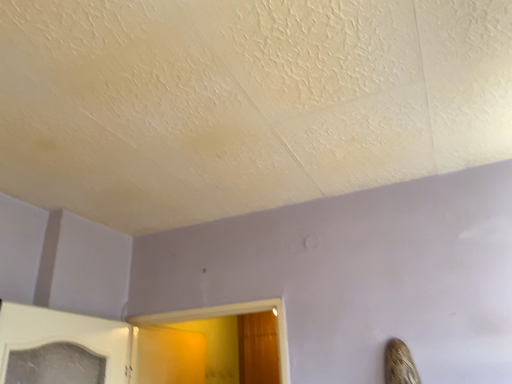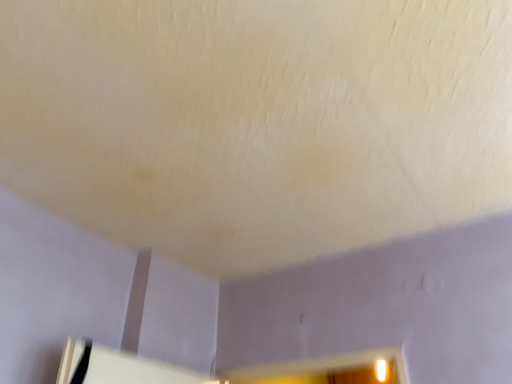
Question: Which way did the camera rotate in the video?

Choices:
 (A) rotated downward
 (B) rotated upward

Answer: (B)